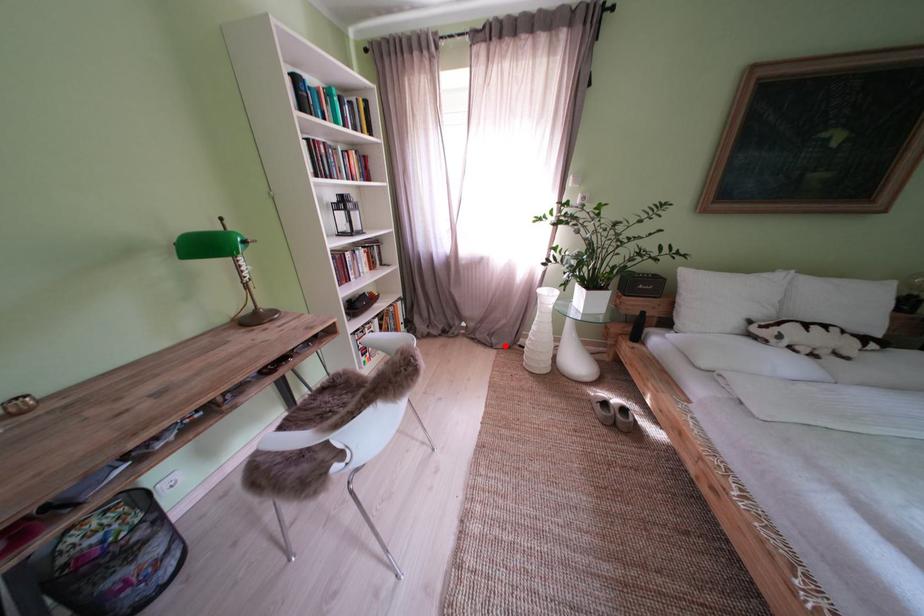
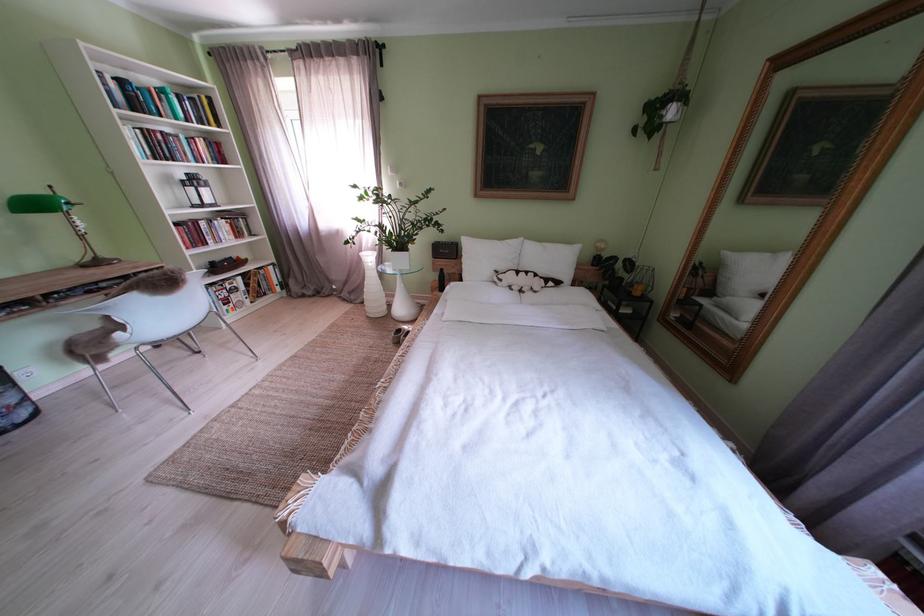
Where in the second image is the point corresponding to the highlighted location from the first image?

(363, 302)